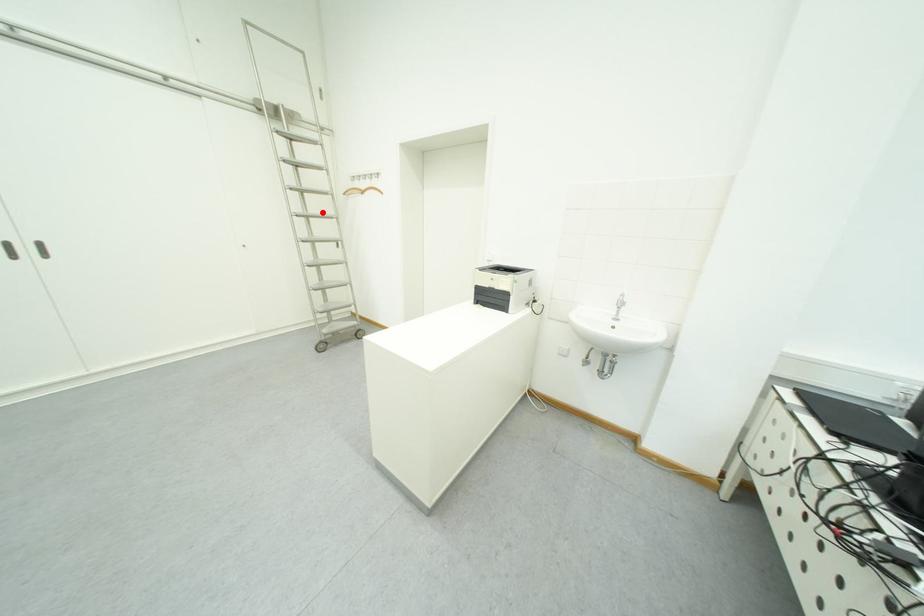
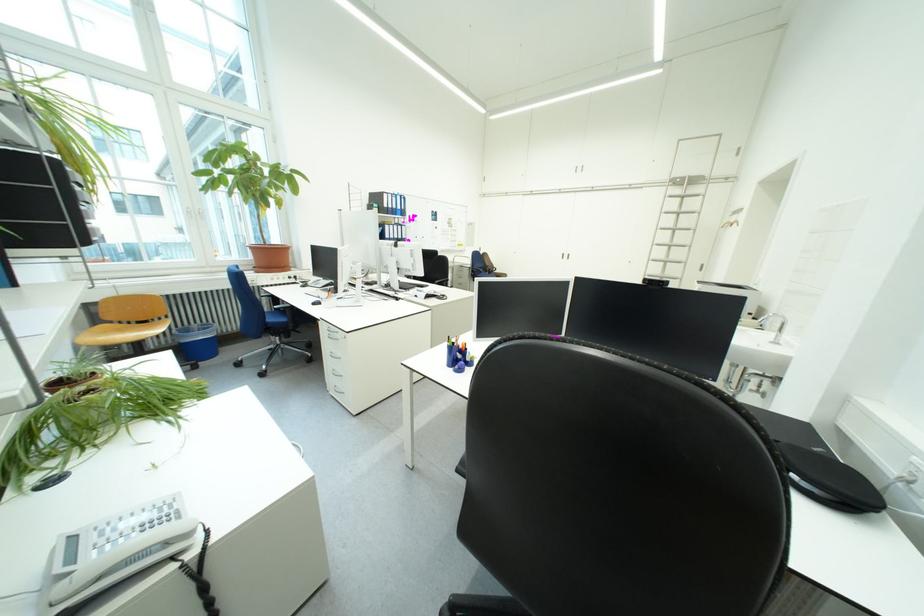
Find the pixel in the second image that matches the highlighted location in the first image.

(687, 244)